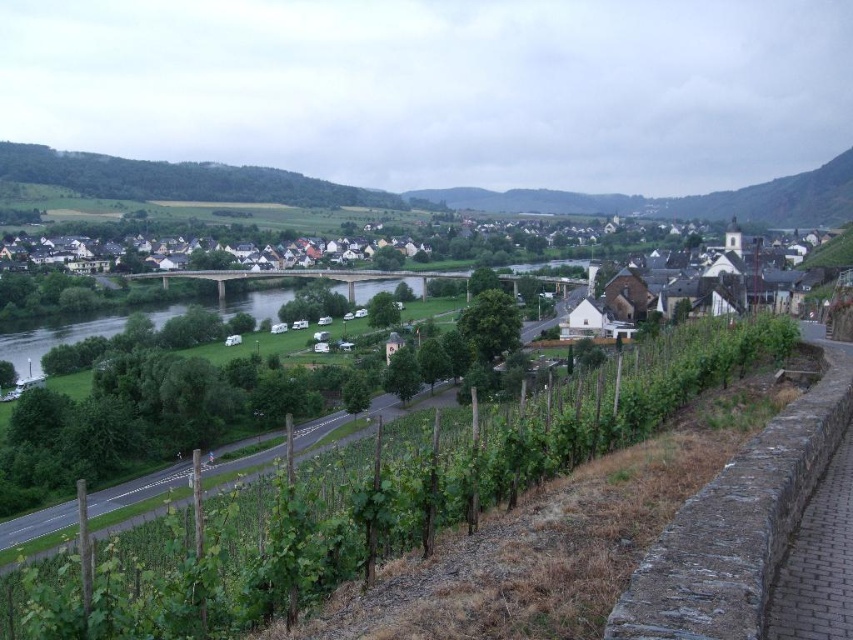
Question: Which object appears closest to the camera in this image?

Choices:
 (A) green grassy river at center
 (B) green leafy vineyard at lower left

Answer: (B)

Question: Which object is farther from the camera taking this photo?

Choices:
 (A) brick paved path at lower right
 (B) green leafy vineyard at lower left
 (C) green grassy river at center

Answer: (C)

Question: Is green leafy vineyard at lower left below white stone church at center-right?

Choices:
 (A) no
 (B) yes

Answer: (B)

Question: Does green leafy vineyard at lower left have a larger size compared to brick paved path at lower right?

Choices:
 (A) no
 (B) yes

Answer: (B)

Question: Which of the following is the closest to the observer?

Choices:
 (A) (817, 568)
 (B) (228, 310)
 (C) (708, 387)

Answer: (A)

Question: From the image, what is the correct spatial relationship of green leafy vineyard at lower left in relation to brick paved path at lower right?

Choices:
 (A) above
 (B) below

Answer: (B)